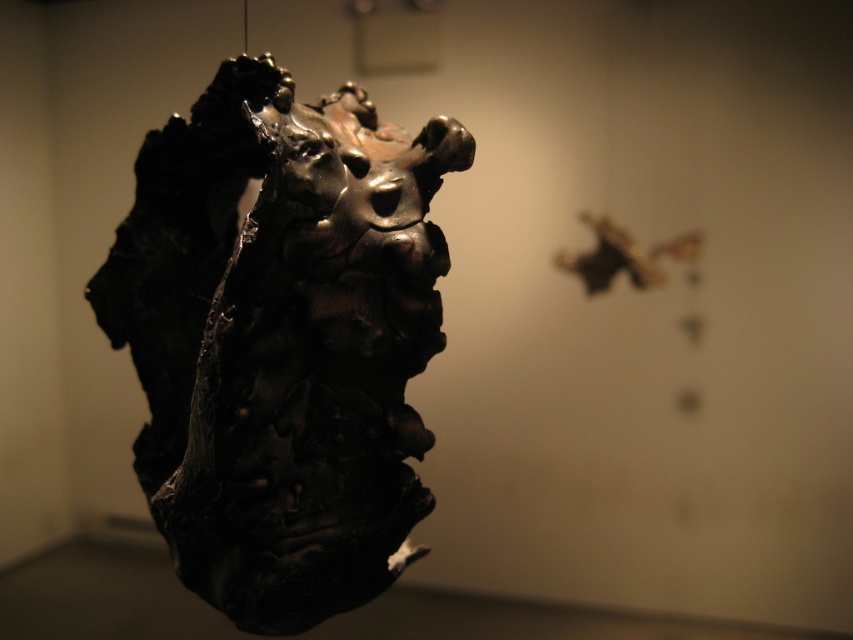
You are an art curator standing in the gallery. You notice a specific point labeled as point (281, 340). Based on the sculpture details, where exactly on the sculpture would this point be located?

The point (281, 340) is located on the matte black sculpture at center.

You are an art critic standing in the gallery. You notice the matte black sculpture at center and the shiny metallic butterfly at upper right. Which object is closer to you based on their positions in the scene?

The matte black sculpture at center is closer to you because it is positioned in front of the shiny metallic butterfly at upper right, which is further back in the scene.

You are an art curator planning to install a new light fixture between the matte black sculpture at center and the shiny metallic butterfly at upper right. The light fixture requires a minimum of 30 inches of space to avoid obstruction. Based on the current arrangement, will there be enough space for the light fixture?

The distance between the matte black sculpture at center and the shiny metallic butterfly at upper right is 29.73 inches, which is slightly less than the required 30 inches. Therefore, there is not enough space to install the light fixture without obstruction.